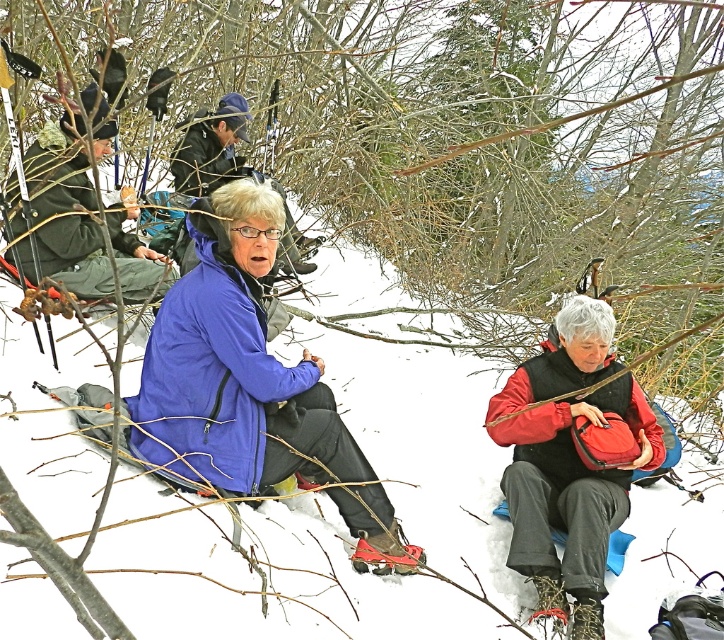
Does blue softshell jacket at center appear over dark blue jacket at upper center?

No.

Describe the element at coordinates (235, 365) in the screenshot. I see `blue softshell jacket at center` at that location.

At what (x,y) coordinates should I click in order to perform the action: click on blue softshell jacket at center. Please return your answer as a coordinate pair (x, y). Looking at the image, I should click on (235, 365).

Is the position of dark blue jacket at upper center less distant than that of red rubber snowshoe at lower center?

No, it is behind red rubber snowshoe at lower center.

Is dark blue jacket at upper center above red rubber snowshoe at lower center?

Correct, dark blue jacket at upper center is located above red rubber snowshoe at lower center.

Image resolution: width=724 pixels, height=640 pixels. What are the coordinates of `dark blue jacket at upper center` in the screenshot? It's located at (211, 148).

Is blue softshell jacket at center behind red rubber snowshoe at lower center?

No, blue softshell jacket at center is closer to the viewer.

Between blue softshell jacket at center and red rubber snowshoe at lower center, which one has more height?

blue softshell jacket at center is taller.

Is point (188, 332) less distant than point (384, 538)?

Yes, point (188, 332) is closer to viewer.

I want to click on blue softshell jacket at center, so click(235, 365).